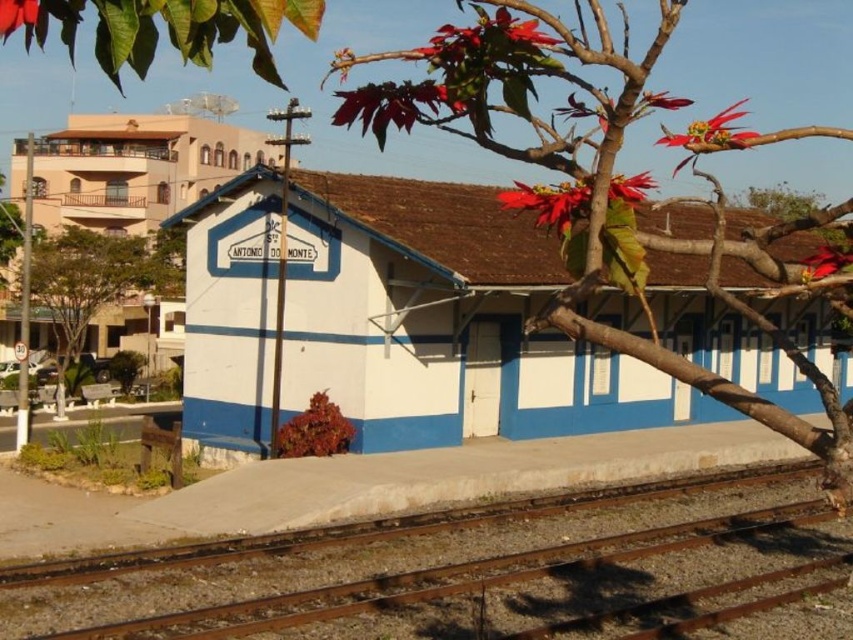
Who is shorter, vibrant red petals at upper right or matte red flower at upper left?

matte red flower at upper left is shorter.

Can you confirm if vibrant red petals at upper right is wider than matte red flower at upper left?

Indeed, vibrant red petals at upper right has a greater width compared to matte red flower at upper left.

The height and width of the screenshot is (640, 853). Identify the location of vibrant red petals at upper right. (712, 131).

Looking at this image, does green leafy tree at left appear on the right side of shiny red petals at upper center?

Incorrect, green leafy tree at left is not on the right side of shiny red petals at upper center.

The height and width of the screenshot is (640, 853). In order to click on green leafy tree at left in this screenshot , I will do `click(97, 278)`.

Is point (91, 291) in front of point (521, 198)?

No, it is behind (521, 198).

What are the coordinates of `green leafy tree at left` in the screenshot? It's located at (97, 278).

What do you see at coordinates (459, 570) in the screenshot? The image size is (853, 640). I see `rusty metal train track at lower center` at bounding box center [459, 570].

Does rusty metal train track at lower center have a greater height compared to red matte flower at upper right?

Incorrect, rusty metal train track at lower center's height is not larger of red matte flower at upper right's.

Does point (253, 634) come closer to viewer compared to point (659, 104)?

That is False.

This screenshot has width=853, height=640. Find the location of `rusty metal train track at lower center`. rusty metal train track at lower center is located at coordinates (459, 570).